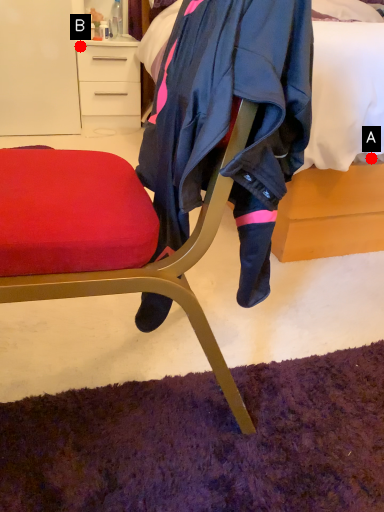
Question: Two points are circled on the image, labeled by A and B beside each circle. Which point appears farthest from the camera in this image?

Choices:
 (A) A is further
 (B) B is further

Answer: (B)